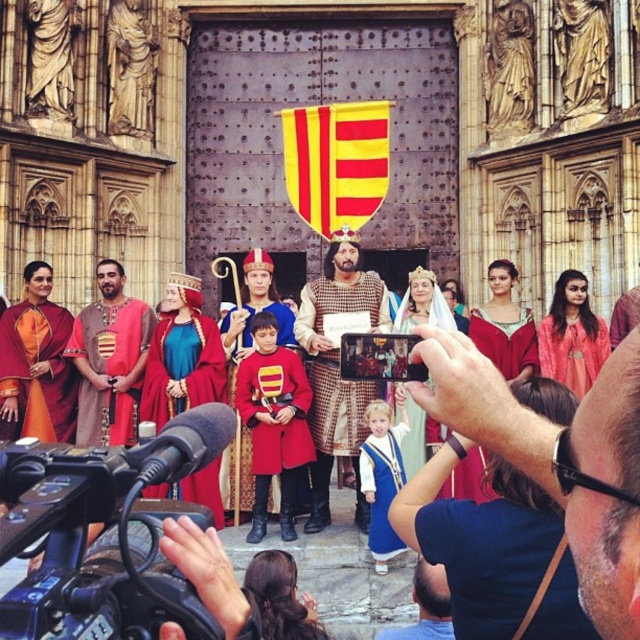
You are a costume designer preparing for a historical play. You have two items from the scene in front of you. The matte gold crown at center and the matte red tunic at center. Which item has a larger width?

The matte gold crown at center has a larger width than the matte red tunic at center according to the description.

You are a photographer trying to capture a photo of the matte red tunic at center and the matte orange robe at left. Since you want both subjects to appear proportionally sized in the frame, which subject should you move closer to the camera?

The matte orange robe at left should be moved closer to the camera because it is shorter than the matte red tunic at center, so moving it closer would make it appear larger in the photo, balancing their sizes.